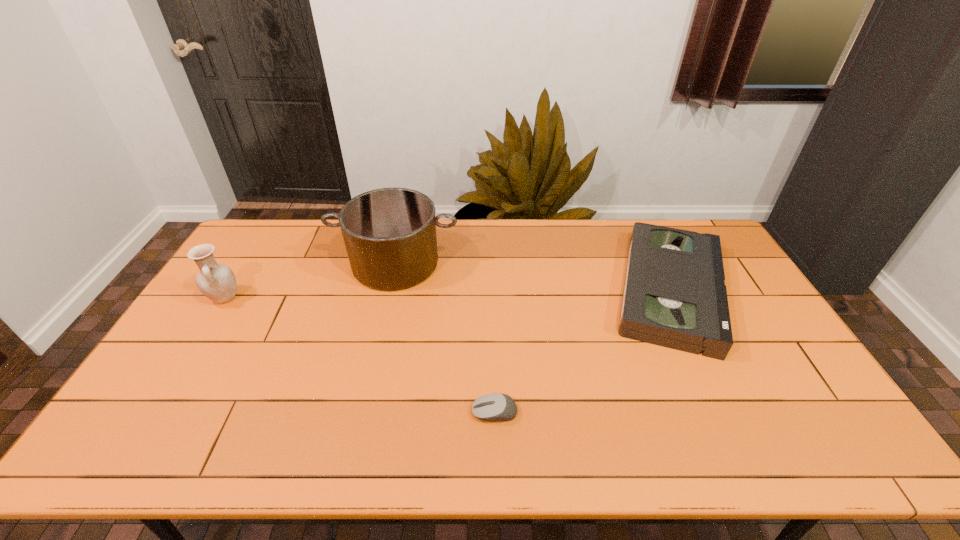
You are a GUI agent. You are given a task and a screenshot of the screen. Output one action in this format:
    pyautogui.click(x=<x>, y=<y>)
    Task: Click on the pan
    The width and height of the screenshot is (960, 540).
    Given the screenshot: What is the action you would take?
    pyautogui.click(x=390, y=237)

Image resolution: width=960 pixels, height=540 pixels. Find the location of `the leftmost object`. the leftmost object is located at coordinates (x=217, y=282).

The width and height of the screenshot is (960, 540). I want to click on the second shortest object, so click(x=675, y=296).

Locate an element on the screen. videotape is located at coordinates [x=675, y=296].

Where is `computer equipment`? computer equipment is located at coordinates (495, 406).

This screenshot has width=960, height=540. In order to click on the second object from right to left in this screenshot , I will do `click(495, 406)`.

Locate an element on the screen. free space located 0.050m on the back of the pan is located at coordinates (403, 230).

Image resolution: width=960 pixels, height=540 pixels. What are the coordinates of `vacant space located 0.290m on the front of the leftmost object` in the screenshot? It's located at (167, 390).

I want to click on vacant region located on the front of the second shortest object, so [728, 409].

What are the coordinates of `vacant space situated on the wheel side of the nearest object` in the screenshot? It's located at (436, 412).